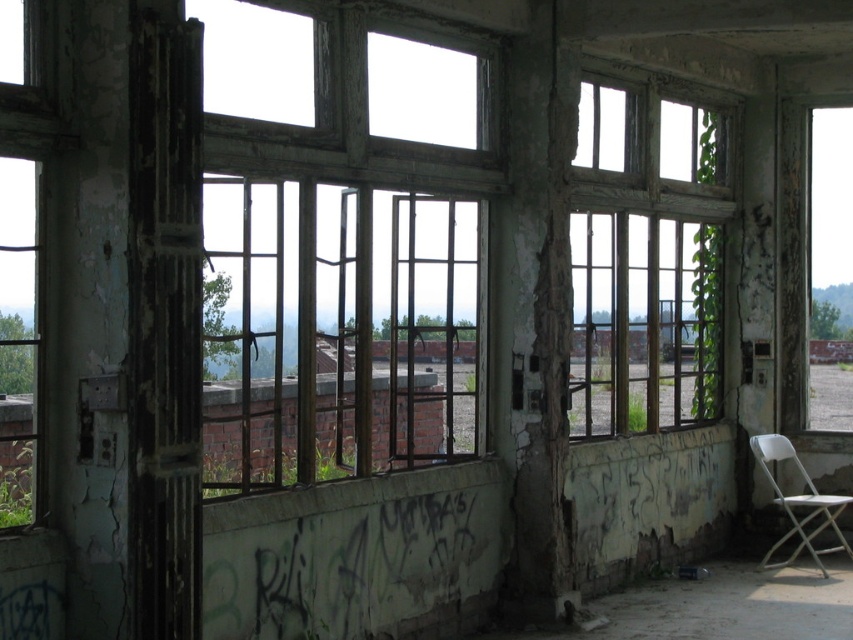
Question: Can you confirm if rusty metal window at right is wider than white plastic folding chair at lower right?

Choices:
 (A) yes
 (B) no

Answer: (B)

Question: Which point is farther to the camera?

Choices:
 (A) white plastic folding chair at lower right
 (B) wooden window at center
 (C) rusty metal window at right

Answer: (C)

Question: Can you confirm if rusty metal window at right is smaller than white plastic folding chair at lower right?

Choices:
 (A) no
 (B) yes

Answer: (B)

Question: Which object is farther from the camera taking this photo?

Choices:
 (A) white plastic folding chair at lower right
 (B) rusty metal window at right
 (C) wooden window at center

Answer: (B)

Question: Which point is closer to the camera?

Choices:
 (A) white plastic folding chair at lower right
 (B) wooden window at center
 (C) rusty metal window at right

Answer: (B)

Question: Does wooden window at center appear under rusty metal window at right?

Choices:
 (A) yes
 (B) no

Answer: (B)